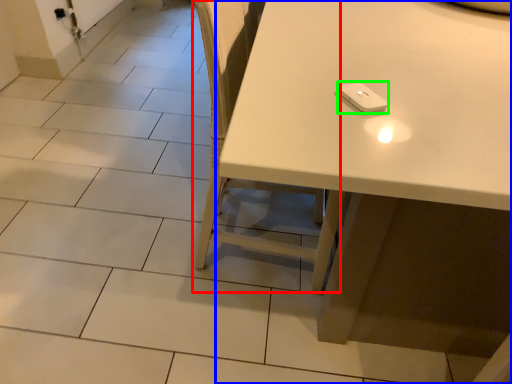
Question: Based on their relative distances, which object is nearer to chair (highlighted by a red box)? Choose from table (highlighted by a blue box) and Wii controller (highlighted by a green box).

Choices:
 (A) table
 (B) Wii controller

Answer: (A)